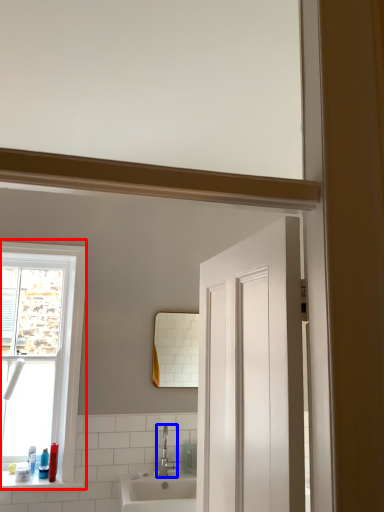
Question: Which of the following is the closest to the observer, window (highlighted by a red box) or tap (highlighted by a blue box)?

Choices:
 (A) window
 (B) tap

Answer: (A)